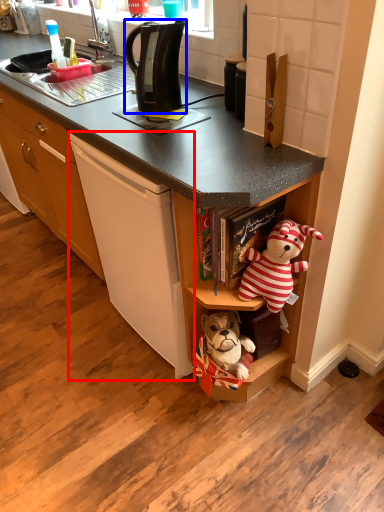
Question: Which object is closer to the camera taking this photo, cording machine (highlighted by a red box) or kitchen appliance (highlighted by a blue box)?

Choices:
 (A) cording machine
 (B) kitchen appliance

Answer: (A)